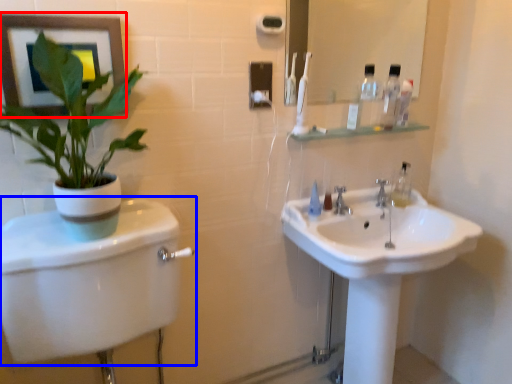
Question: Which point is closer to the camera, picture frame (highlighted by a red box) or toilet (highlighted by a blue box)?

Choices:
 (A) picture frame
 (B) toilet

Answer: (B)